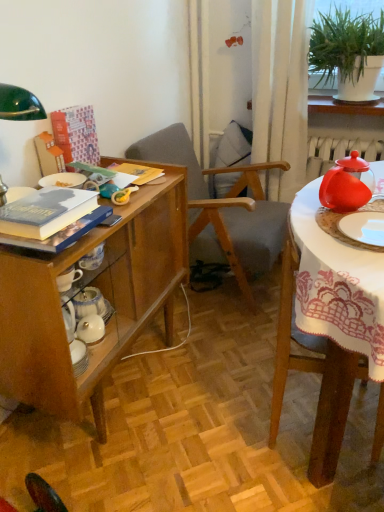
This screenshot has width=384, height=512. Identify the location of free space above white glossy plate at right, arranged as the second tableware when viewed from the top (from a real-world perspective). (368, 219).